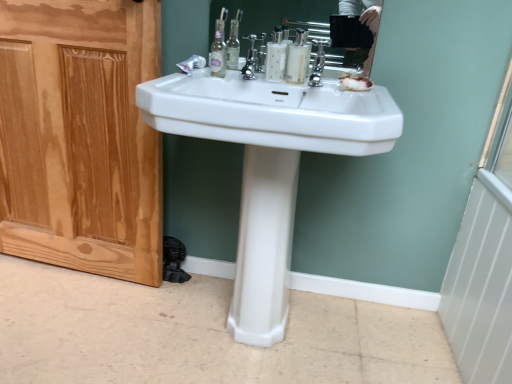
Question: Is natural wood screen door at left positioned beyond the bounds of white glossy sink at center?

Choices:
 (A) yes
 (B) no

Answer: (A)

Question: Does natural wood screen door at left touch white glossy sink at center?

Choices:
 (A) no
 (B) yes

Answer: (A)

Question: From a real-world perspective, is natural wood screen door at left located beneath white glossy sink at center?

Choices:
 (A) yes
 (B) no

Answer: (A)

Question: From a real-world perspective, is natural wood screen door at left physically above white glossy sink at center?

Choices:
 (A) no
 (B) yes

Answer: (A)

Question: Can you confirm if natural wood screen door at left is wider than white glossy sink at center?

Choices:
 (A) no
 (B) yes

Answer: (A)

Question: From a real-world perspective, is marbled white soap at center above or below polished chrome faucet at center?

Choices:
 (A) below
 (B) above

Answer: (A)

Question: Considering the relative positions of marbled white soap at center and polished chrome faucet at center in the image provided, is marbled white soap at center to the left or to the right of polished chrome faucet at center?

Choices:
 (A) left
 (B) right

Answer: (B)

Question: Does point (357, 84) appear closer or farther from the camera than point (249, 69)?

Choices:
 (A) farther
 (B) closer

Answer: (B)

Question: From the image's perspective, is marbled white soap at center above or below polished chrome faucet at center?

Choices:
 (A) above
 (B) below

Answer: (B)

Question: Looking at their shapes, would you say white glossy mouthwash at center, which ranks as the 2th mouthwash in left-to-right order, is wider or thinner than natural wood screen door at left?

Choices:
 (A) wide
 (B) thin

Answer: (B)

Question: Is white glossy mouthwash at center, acting as the 1th mouthwash starting from the right, inside the boundaries of natural wood screen door at left, or outside?

Choices:
 (A) outside
 (B) inside

Answer: (A)

Question: From the image's perspective, relative to natural wood screen door at left, is white glossy mouthwash at center, which ranks as the 2th mouthwash in left-to-right order, above or below?

Choices:
 (A) below
 (B) above

Answer: (B)

Question: From a real-world perspective, is white glossy mouthwash at center, acting as the 1th mouthwash starting from the right, physically located above or below natural wood screen door at left?

Choices:
 (A) below
 (B) above

Answer: (B)

Question: Considering the positions of natural wood screen door at left and white glossy mouthwash at center, which ranks as the 2th mouthwash in left-to-right order, in the image, is natural wood screen door at left bigger or smaller than white glossy mouthwash at center, which ranks as the 2th mouthwash in left-to-right order,?

Choices:
 (A) big
 (B) small

Answer: (A)

Question: Visually, is natural wood screen door at left positioned to the left or to the right of white glossy mouthwash at center, which ranks as the 2th mouthwash in left-to-right order?

Choices:
 (A) left
 (B) right

Answer: (A)